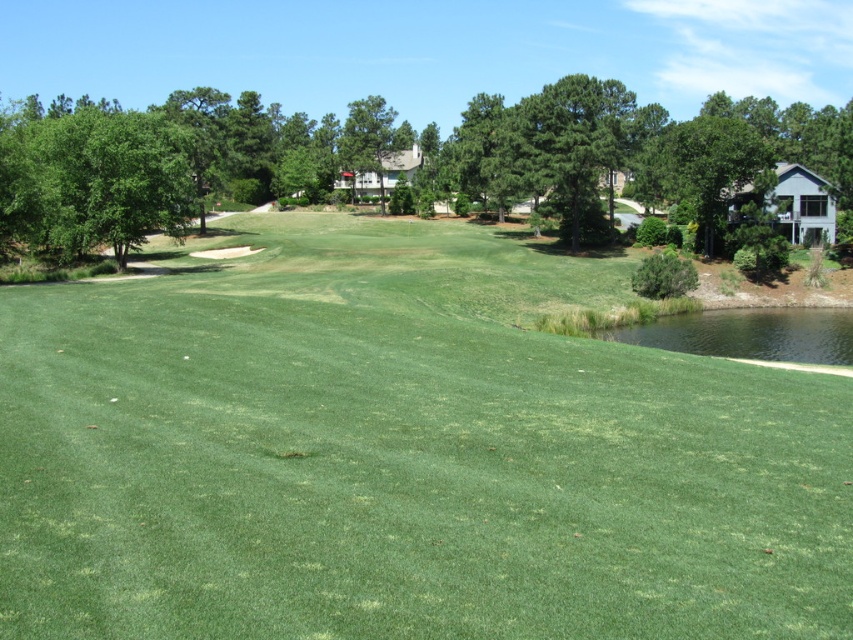
Looking at this image, you are a golfer planning to hit a ball from the green grass at center towards the green leafy tree at upper center. Considering the spatial relationship between them, which object is wider in the image?

The green grass at center is narrower than the green leafy tree at upper center in the image, so the green leafy tree at upper center is wider.

You are standing at the point labeled point (585, 516) and want to walk towards the point labeled point (126, 172). Which direction should you move to get closer to your destination?

Since point (585, 516) is closer to the viewer than point (126, 172), you should move forward towards the direction of the point (126, 172) to get closer to your destination.